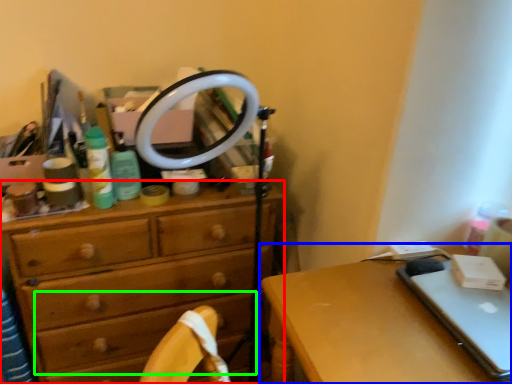
Question: Estimate the real-world distances between objects in this image. Which object is closer to chest of drawers (highlighted by a red box), desk (highlighted by a blue box) or drawer (highlighted by a green box)?

Choices:
 (A) desk
 (B) drawer

Answer: (B)